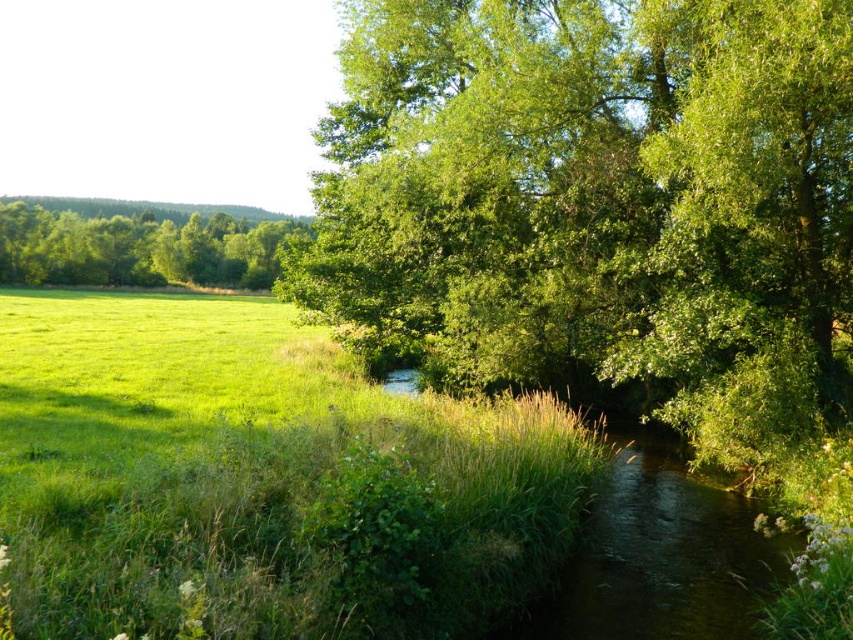
Question: Can you confirm if green leafy tree at center is wider than green leafy tree at left?

Choices:
 (A) no
 (B) yes

Answer: (A)

Question: Is green leafy tree at center below green leafy tree at left?

Choices:
 (A) no
 (B) yes

Answer: (B)

Question: Does green leafy tree at center appear over green leafy tree at left?

Choices:
 (A) no
 (B) yes

Answer: (A)

Question: Which point appears closest to the camera in this image?

Choices:
 (A) (358, 138)
 (B) (49, 257)

Answer: (A)